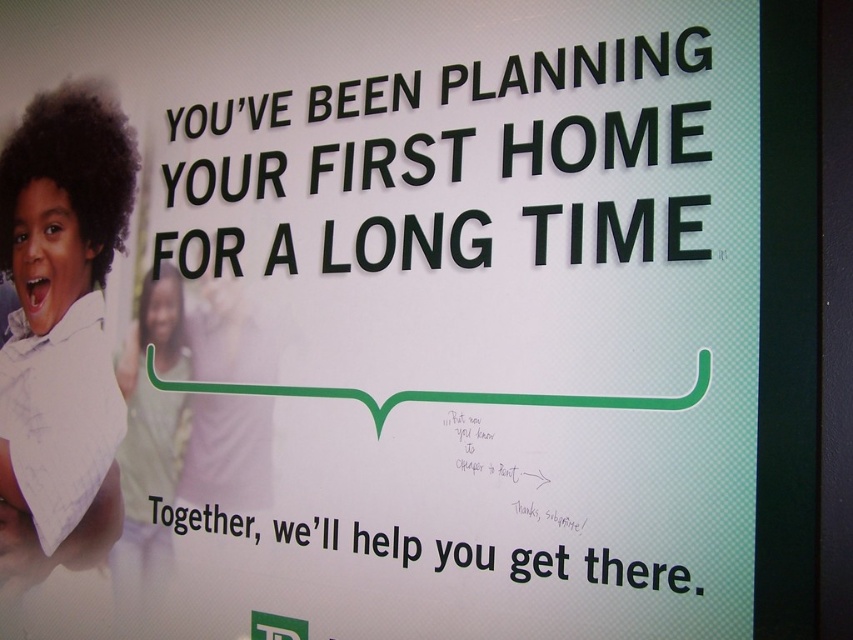
Question: Considering the relative positions of black paper text at lower center and black curly hair at upper left in the image provided, where is black paper text at lower center located with respect to black curly hair at upper left?

Choices:
 (A) below
 (B) above

Answer: (A)

Question: In this image, where is matte white shirt at left located relative to black curly hair at upper left?

Choices:
 (A) above
 (B) below

Answer: (A)

Question: Estimate the real-world distances between objects in this image. Which object is farther from the black curly hair at upper left?

Choices:
 (A) light green fabric at left
 (B) black paper text at lower center
 (C) matte white shirt at left
 (D) dark curly hair at upper left

Answer: (B)

Question: Based on their relative distances, which object is nearer to the black curly hair at upper left?

Choices:
 (A) black paper text at lower center
 (B) matte white shirt at left
 (C) light green fabric at left
 (D) black plastic text at upper center

Answer: (C)

Question: Can you confirm if matte white shirt at left is thinner than black plastic text at upper center?

Choices:
 (A) no
 (B) yes

Answer: (B)

Question: Which object is the farthest from the black paper text at lower center?

Choices:
 (A) black plastic text at upper center
 (B) light green fabric at left
 (C) dark curly hair at upper left

Answer: (C)